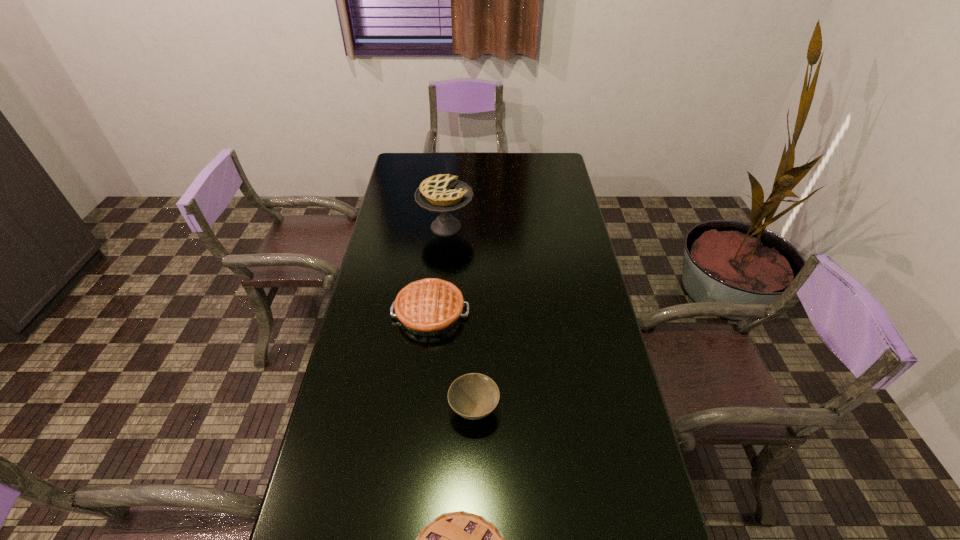
In the image, there is a desktop. At what (x,y) coordinates should I click in order to perform the action: click on free space at the right edge. Please return your answer as a coordinate pair (x, y). Image resolution: width=960 pixels, height=540 pixels. Looking at the image, I should click on (550, 208).

The image size is (960, 540). I want to click on vacant space at the far left corner of the desktop, so [401, 163].

The image size is (960, 540). Identify the location of vacant space at the far right corner of the desktop. tap(562, 163).

Image resolution: width=960 pixels, height=540 pixels. Identify the location of blank region between the tallest pie and the second farthest object. (438, 270).

Identify the location of unoccupied position between the second nearest object and the second nearest pie. This screenshot has width=960, height=540. [452, 361].

Image resolution: width=960 pixels, height=540 pixels. I want to click on free space between the second farthest object and the tallest object, so click(438, 270).

Find the location of `vacant space that is in between the bowl and the tallest object`. vacant space that is in between the bowl and the tallest object is located at coordinates tap(460, 319).

Locate an element on the screen. The width and height of the screenshot is (960, 540). vacant space that is in between the second nearest object and the second farthest pie is located at coordinates (452, 361).

Identify the location of free space between the second farthest pie and the second nearest object. Image resolution: width=960 pixels, height=540 pixels. (452, 361).

Choose which object is the second nearest neighbor to the second shortest pie. Please provide its 2D coordinates. Your answer should be formatted as a tuple, i.e. [(x, y)], where the tuple contains the x and y coordinates of a point satisfying the conditions above.

[(443, 193)]